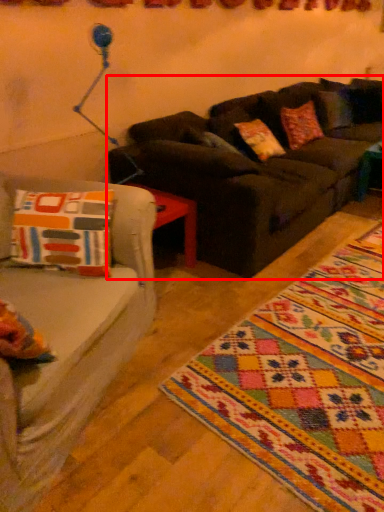
Question: From the image, what is the correct spatial relationship of studio couch (annotated by the red box) in relation to mat?

Choices:
 (A) left
 (B) right

Answer: (A)